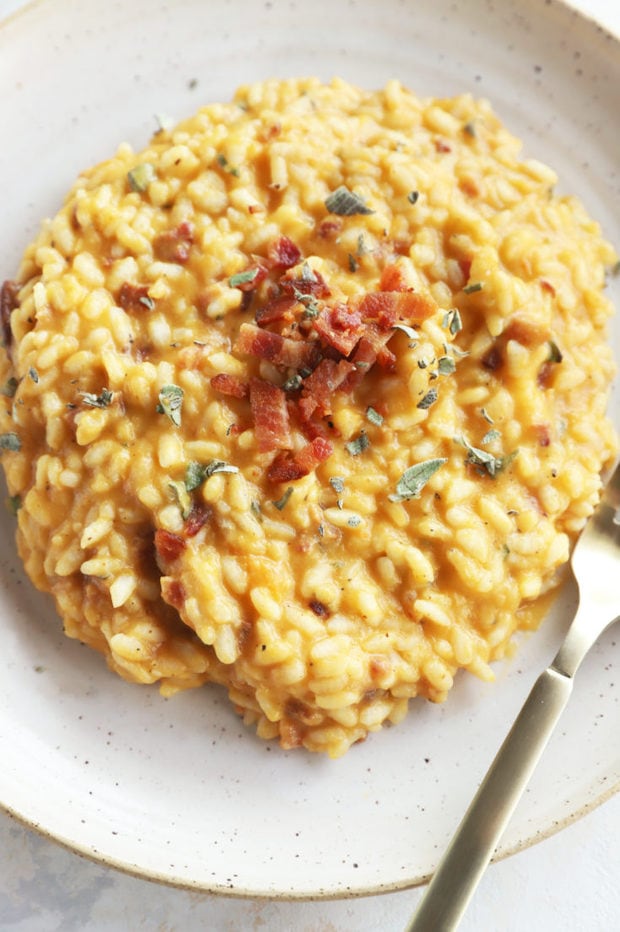
Locate an element on the screen. dots on plate is located at coordinates (426, 757), (237, 871), (226, 878), (85, 759), (82, 723), (205, 741), (356, 864), (296, 835), (105, 832), (82, 819).